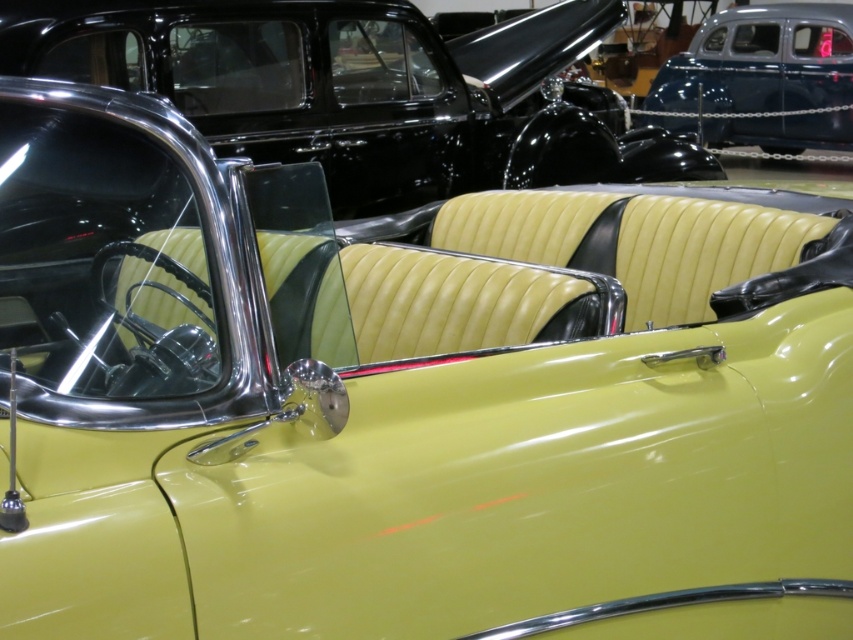
Can you confirm if matte yellow leather car at center is positioned to the left of matte blue car at upper right?

Yes, matte yellow leather car at center is to the left of matte blue car at upper right.

Does matte yellow leather car at center have a greater width compared to matte blue car at upper right?

Yes, matte yellow leather car at center is wider than matte blue car at upper right.

Which is in front, point (399, 96) or point (815, 48)?

Point (399, 96) is in front.

The height and width of the screenshot is (640, 853). I want to click on matte yellow leather car at center, so click(361, 90).